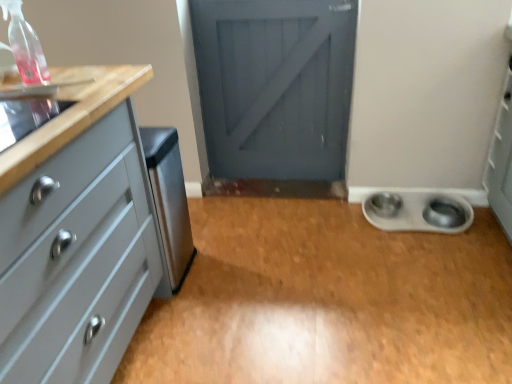
I want to click on free space that is in between stainless steel trash can at left, the 2th appliance viewed from the right, and metallic silver bowl at lower right, so click(x=271, y=242).